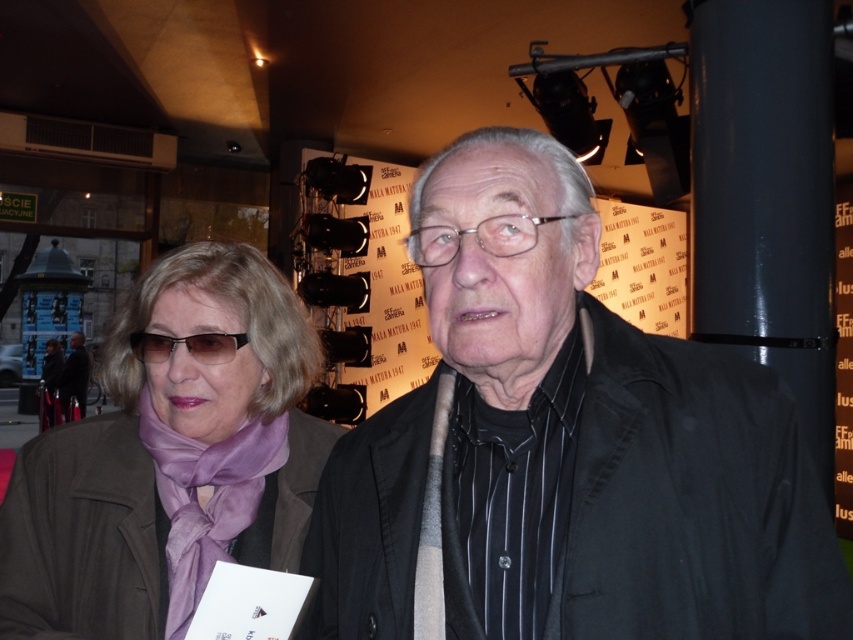
Question: Which of the following is the closest to the observer?

Choices:
 (A) (138, 355)
 (B) (202, 538)

Answer: (B)

Question: Is matte black glasses at center above matte black jacket at center?

Choices:
 (A) no
 (B) yes

Answer: (B)

Question: Which of the following is the farthest from the observer?

Choices:
 (A) (310, 378)
 (B) (732, 552)
 (C) (61, 403)
 (D) (233, 346)

Answer: (C)

Question: Which point is closer to the camera taking this photo?

Choices:
 (A) (177, 339)
 (B) (65, 397)
 (C) (519, 586)
 (D) (120, 476)

Answer: (C)

Question: Does matte purple scarf at center appear on the left side of matte black jacket at center?

Choices:
 (A) no
 (B) yes

Answer: (A)

Question: Does matte purple scarf at center have a larger size compared to matte black jacket at center?

Choices:
 (A) yes
 (B) no

Answer: (B)